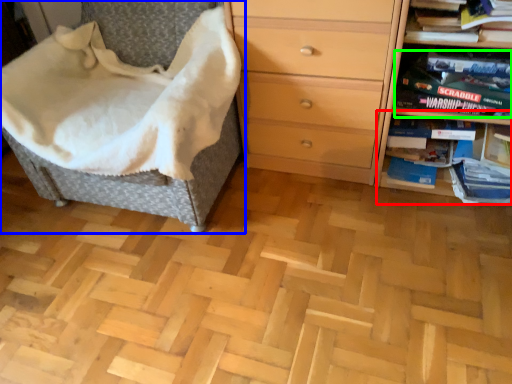
Question: Based on their relative distances, which object is farther from shelf (highlighted by a red box)? Choose from furniture (highlighted by a blue box) and paperback book (highlighted by a green box).

Choices:
 (A) furniture
 (B) paperback book

Answer: (A)